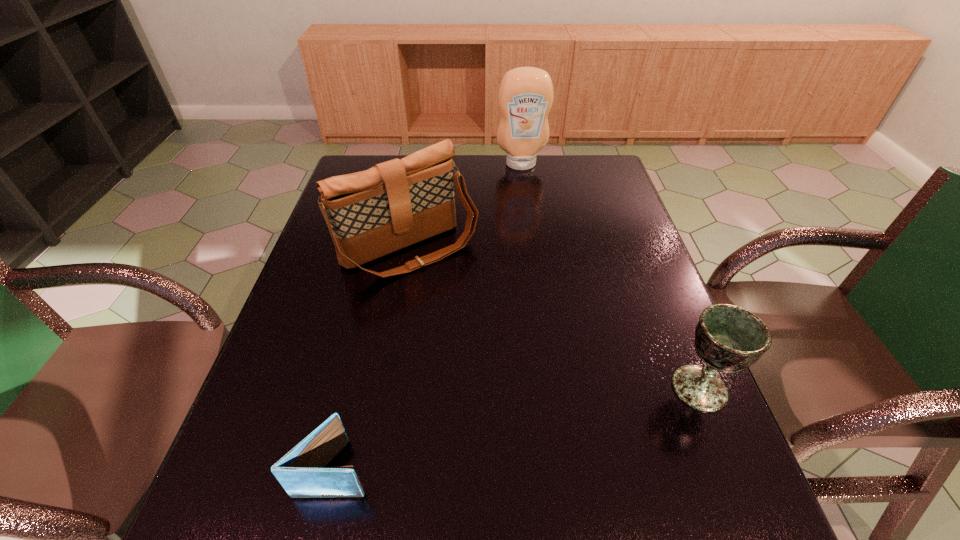
Identify the location of vacant area situated 0.240m on the front-facing side of the shoulder bag. (500, 341).

Find the location of a particular element. This screenshot has height=540, width=960. free point located on the front-facing side of the shoulder bag is located at coordinates (480, 318).

Identify the location of vacant region located on the front-facing side of the shoulder bag. (542, 389).

Where is `vacant area located 0.350m on the label of the third object from left to right`? Image resolution: width=960 pixels, height=540 pixels. vacant area located 0.350m on the label of the third object from left to right is located at coordinates (538, 236).

This screenshot has width=960, height=540. Identify the location of vacant area located on the label of the third object from left to right. coord(539,240).

In order to click on vacant space located on the label of the third object from left to right in this screenshot , I will do `click(538, 236)`.

Find the location of a particular element. This screenshot has height=540, width=960. object positioned at the far edge is located at coordinates (525, 97).

Where is `object that is at the near edge`? Image resolution: width=960 pixels, height=540 pixels. object that is at the near edge is located at coordinates (301, 472).

Locate an element on the screen. wallet that is at the left edge is located at coordinates (301, 472).

Find the location of a particular element. The image size is (960, 540). shoulder bag positioned at the left edge is located at coordinates (372, 213).